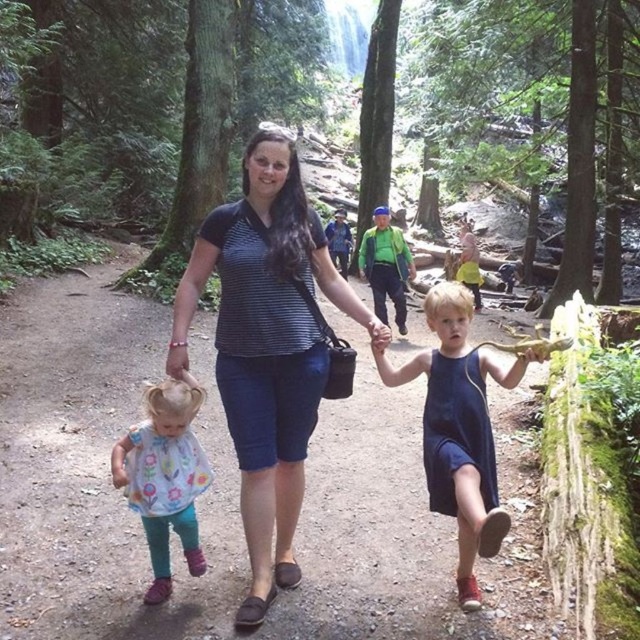
Is green matte forest at center smaller than floral-patterned fabric dress at lower left?

Incorrect, green matte forest at center is not smaller in size than floral-patterned fabric dress at lower left.

Describe the element at coordinates (88, 108) in the screenshot. I see `green matte forest at center` at that location.

Who is more forward, (611, 248) or (150, 387)?

Positioned in front is point (150, 387).

You are a GUI agent. You are given a task and a screenshot of the screen. Output one action in this format:
    pyautogui.click(x=<x>, y=<y>)
    Task: Click on the green matte forest at center
    
    Given the screenshot: What is the action you would take?
    pyautogui.click(x=88, y=108)

Does blue denim dress at center appear on the right side of blue fabric dress at center?

No, blue denim dress at center is not to the right of blue fabric dress at center.

I want to click on blue denim dress at center, so click(x=228, y=493).

You are a GUI agent. You are given a task and a screenshot of the screen. Output one action in this format:
    pyautogui.click(x=<x>, y=<y>)
    Task: Click on the blue denim dress at center
    
    Given the screenshot: What is the action you would take?
    pyautogui.click(x=228, y=493)

From the picture: Does striped fabric shirt at center have a greater width compared to blue fabric dress at center?

Indeed, striped fabric shirt at center has a greater width compared to blue fabric dress at center.

Is striped fabric shirt at center above blue fabric dress at center?

Indeed, striped fabric shirt at center is positioned over blue fabric dress at center.

The width and height of the screenshot is (640, 640). What do you see at coordinates (266, 348) in the screenshot?
I see `striped fabric shirt at center` at bounding box center [266, 348].

Where is `striped fabric shirt at center`? striped fabric shirt at center is located at coordinates (266, 348).